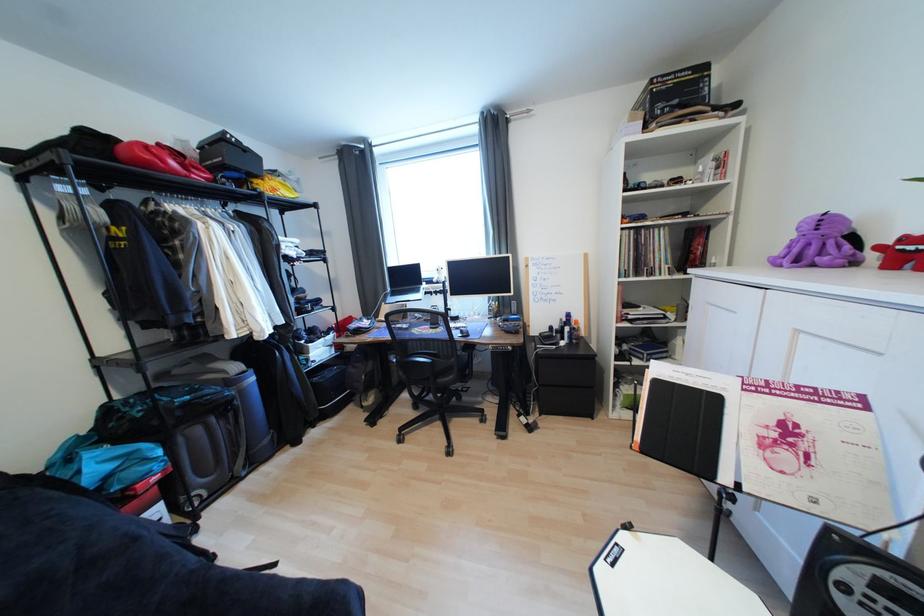
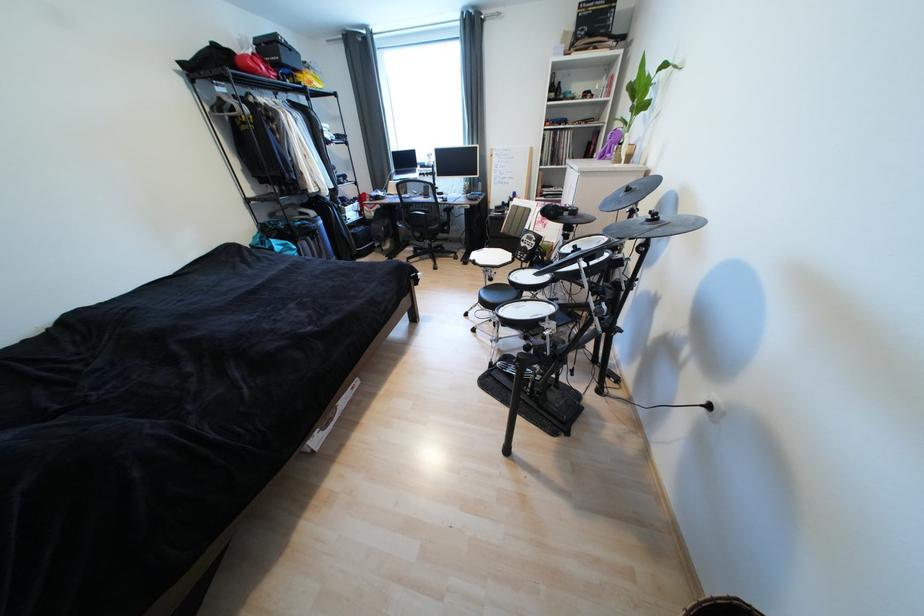
Where in the second image is the point corresponding to [508,431] from the first image?

(472, 262)